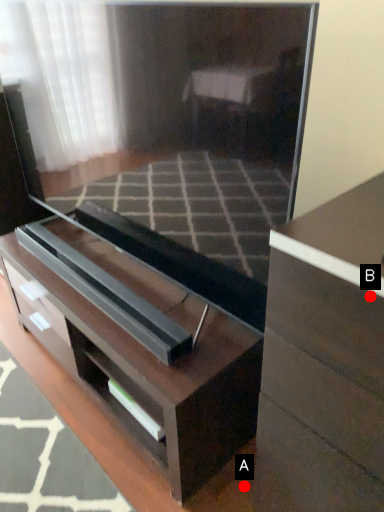
Question: Two points are circled on the image, labeled by A and B beside each circle. Among these points, which one is nearest to the camera?

Choices:
 (A) A is closer
 (B) B is closer

Answer: (B)